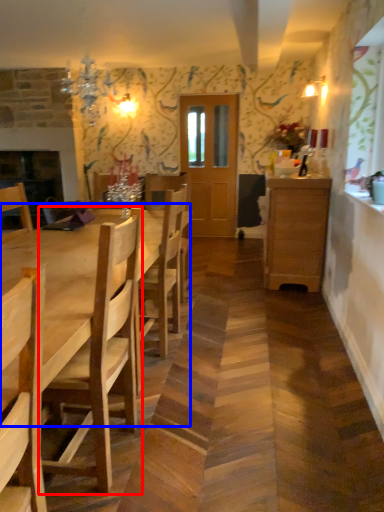
Question: Which object is closer to the camera taking this photo, chair (highlighted by a red box) or kitchen & dining room table (highlighted by a blue box)?

Choices:
 (A) chair
 (B) kitchen & dining room table

Answer: (B)